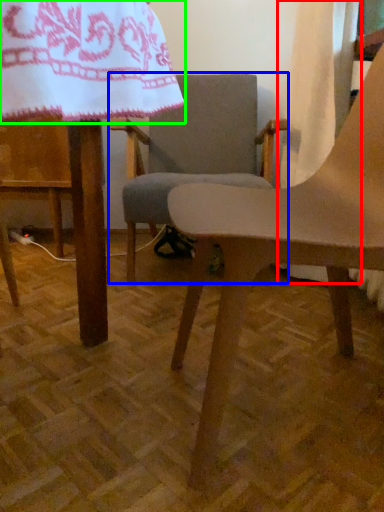
Question: Estimate the real-world distances between objects in this image. Which object is closer to curtain (highlighted by a red box), chair (highlighted by a blue box) or blanket (highlighted by a green box)?

Choices:
 (A) chair
 (B) blanket

Answer: (A)